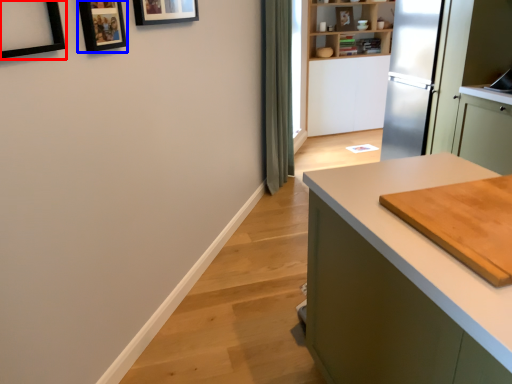
Question: Which of the following is the farthest to the observer, picture frame (highlighted by a red box) or picture frame (highlighted by a blue box)?

Choices:
 (A) picture frame
 (B) picture frame

Answer: (B)